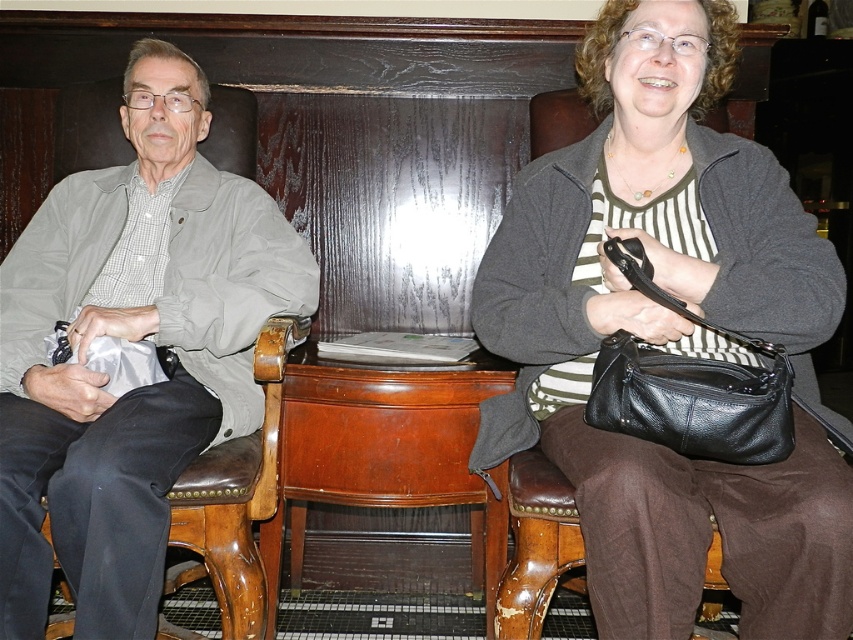
You are a delivery person who needs to place a package between the matte black purse at right and the brown leather stool at lower right. The package is 12 inches long. Can you fit the package between them without moving the purse or the stool?

The distance between the matte black purse at right and the brown leather stool at lower right is 11.70 inches. Since the package is 12 inches long, it cannot fit between them without moving the objects as it is slightly longer than the available space.

You are an interior designer analyzing the placement of objects in the image. The scene has a person on the left and a person on the right. Where is the matte black purse at right located in 2D coordinates?

The matte black purse at right is located at the 2D coordinates point (670, 337).

You are a security guard at the entrance of a building and need to check the purses of people entering. You see the matte black purse at right and the matte gray jacket at left. Which object is wider so you can prioritize checking the wider one first?

The matte gray jacket at left is wider than the matte black purse at right, so you should prioritize checking the matte gray jacket at left first.